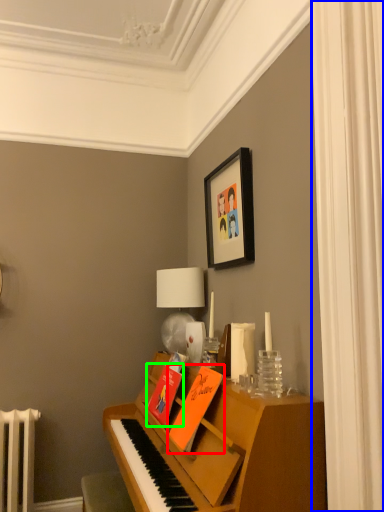
Question: Estimate the real-world distances between objects in this image. Which object is farther from book (highlighted by a red box), curtain (highlighted by a blue box) or book (highlighted by a green box)?

Choices:
 (A) curtain
 (B) book

Answer: (A)